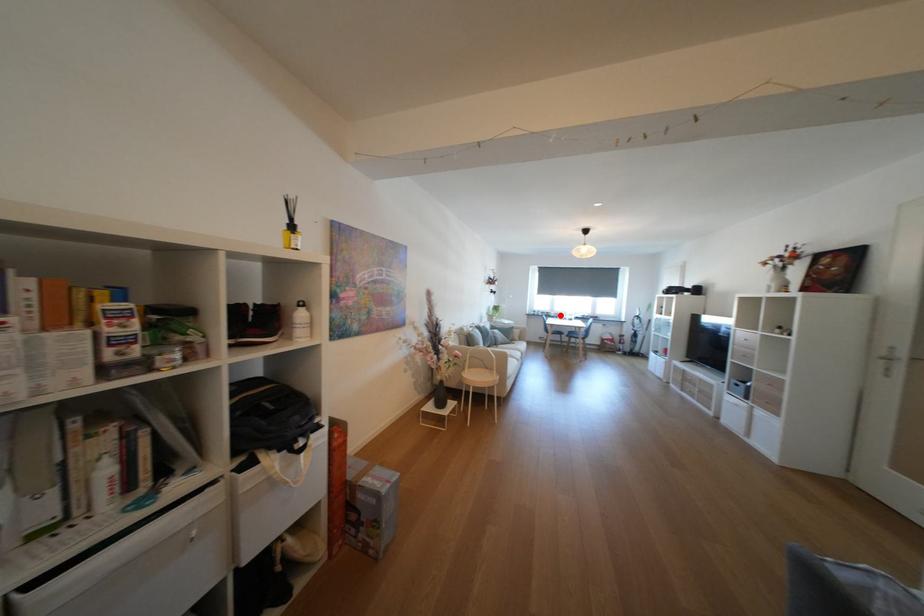
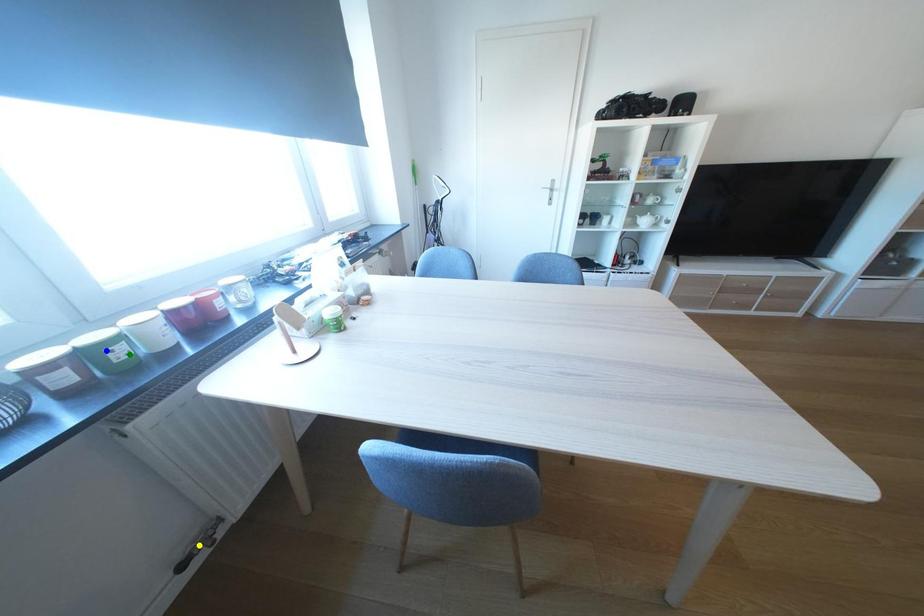
Question: I am providing you with two images of the same scene from different viewpoints. A red point is marked on the first image. You are given multiple points on the second image. Which mark in image 2 goes with the point in image 1?

Choices:
 (A) blue point
 (B) yellow point
 (C) green point

Answer: (C)